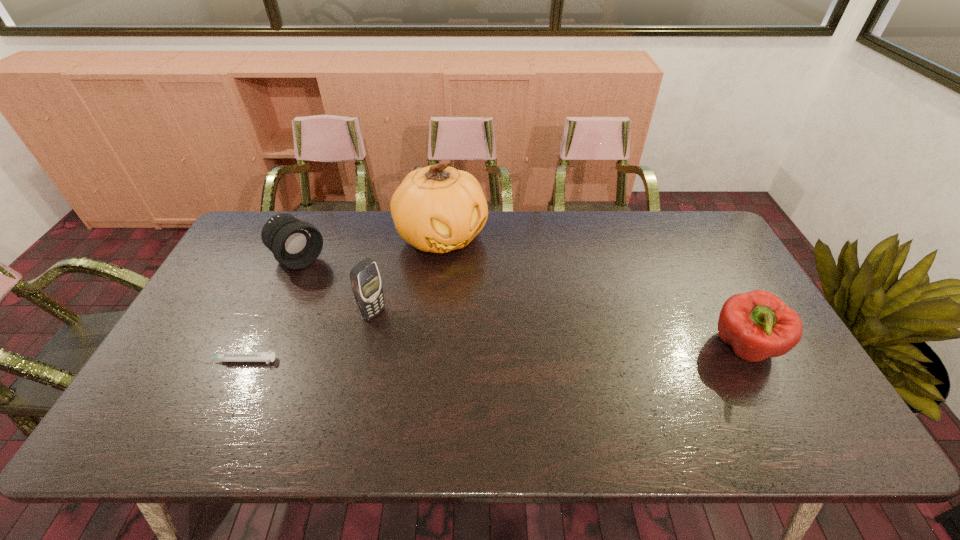
The height and width of the screenshot is (540, 960). I want to click on free space that is in between the telephoto lens and the rightmost object, so click(521, 303).

The width and height of the screenshot is (960, 540). What are the coordinates of `free space between the tallest object and the cellular telephone` in the screenshot? It's located at (408, 275).

Where is `free area in between the cellular telephone and the tallest object`? free area in between the cellular telephone and the tallest object is located at coordinates (408, 275).

I want to click on vacant area that lies between the cellular telephone and the syringe, so click(x=306, y=336).

This screenshot has width=960, height=540. Find the location of `vacant space that is in between the pumpkin and the rightmost object`. vacant space that is in between the pumpkin and the rightmost object is located at coordinates (592, 292).

This screenshot has height=540, width=960. Identify the location of free space between the pumpkin and the syringe. (340, 299).

Where is `free spot between the rightmost object and the syringe`? This screenshot has height=540, width=960. free spot between the rightmost object and the syringe is located at coordinates (492, 354).

Where is `free spot between the syringe and the telephoto lens`? This screenshot has height=540, width=960. free spot between the syringe and the telephoto lens is located at coordinates pyautogui.click(x=269, y=309).

This screenshot has width=960, height=540. In order to click on empty space that is in between the cellular telephone and the pumpkin in this screenshot , I will do point(408,275).

What are the coordinates of `free space that is in between the cellular telephone and the shortest object` in the screenshot? It's located at (306, 336).